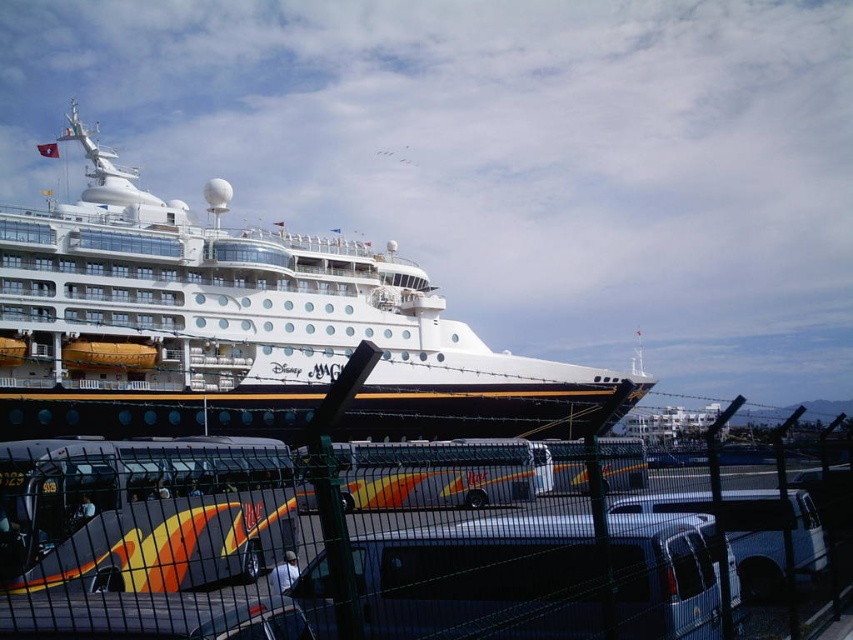
Between black wire mesh fence at center and white glossy cruise ship at center, which one is positioned higher?

white glossy cruise ship at center is above.

The height and width of the screenshot is (640, 853). Identify the location of black wire mesh fence at center. (554, 552).

Between point (339, 486) and point (169, 397), which one is positioned behind?

Positioned behind is point (169, 397).

The image size is (853, 640). In order to click on black wire mesh fence at center in this screenshot , I will do `click(554, 552)`.